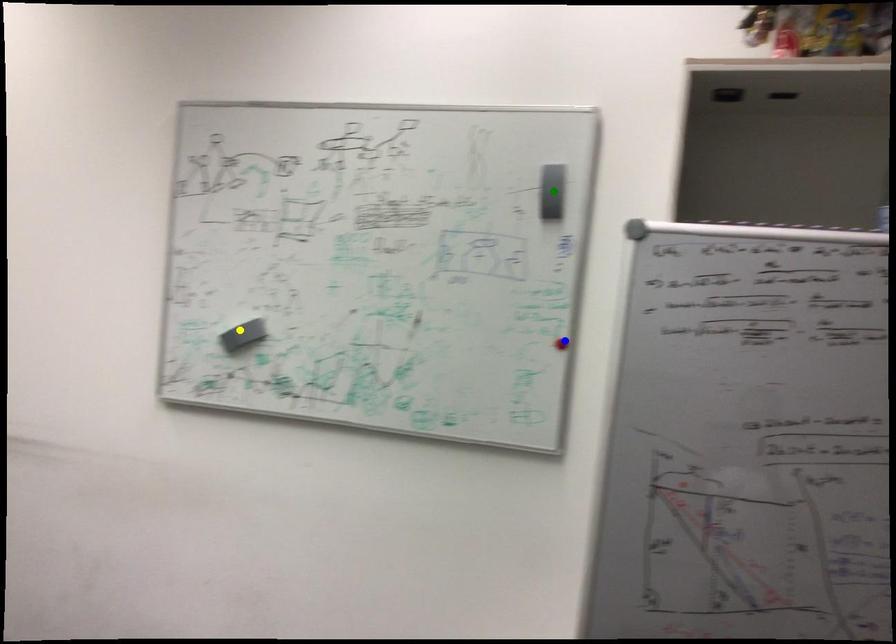
Order these from nearest to farthest:
blue point
yellow point
green point

green point
blue point
yellow point